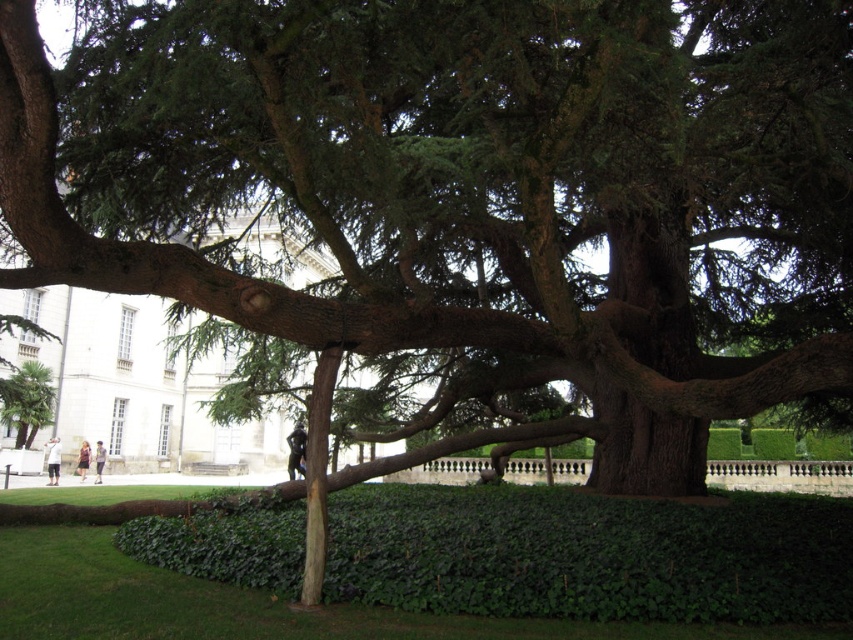
Who is positioned more to the right, green leafy hedge at lower center or green leafy palm at lower left?

green leafy hedge at lower center is more to the right.

Between green leafy hedge at lower center and green leafy palm at lower left, which one has less height?

Standing shorter between the two is green leafy hedge at lower center.

In order to click on green leafy hedge at lower center in this screenshot , I will do `click(590, 554)`.

Is brown rough bark at center shorter than green leafy palm at lower left?

Incorrect, brown rough bark at center's height does not fall short of green leafy palm at lower left's.

Who is higher up, brown rough bark at center or green leafy palm at lower left?

brown rough bark at center

Who is more distant from viewer, (679, 259) or (20, 435)?

Point (20, 435)

This screenshot has width=853, height=640. Find the location of `brown rough bark at center`. brown rough bark at center is located at coordinates (648, 289).

Is green leafy hedge at lower center shorter than brown rough bark at center?

Indeed, green leafy hedge at lower center has a lesser height compared to brown rough bark at center.

How distant is green leafy hedge at lower center from brown rough bark at center?

green leafy hedge at lower center is 11.73 meters away from brown rough bark at center.

Does point (244, 540) come farther from viewer compared to point (612, 451)?

No, it is in front of (612, 451).

Where is `green leafy hedge at lower center`? Image resolution: width=853 pixels, height=640 pixels. green leafy hedge at lower center is located at coordinates (590, 554).